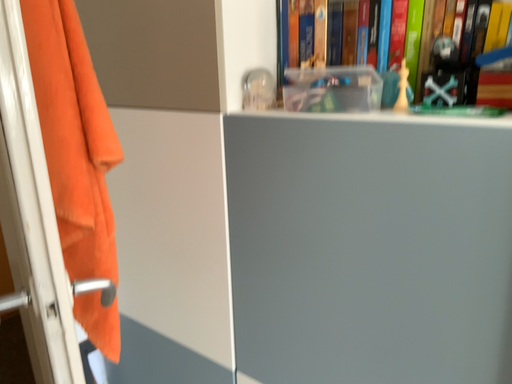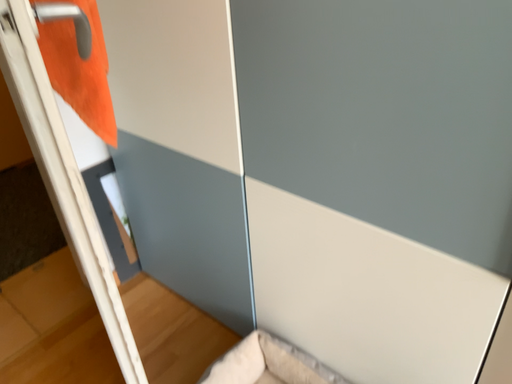
Question: How did the camera likely rotate when shooting the video?

Choices:
 (A) rotated downward
 (B) rotated upward

Answer: (A)